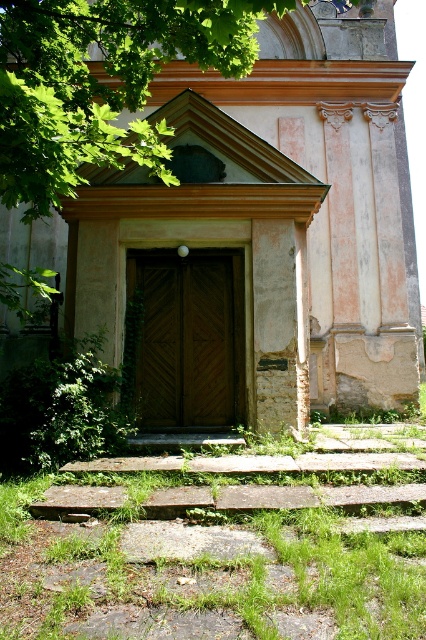
Who is more forward, (256, 179) or (109, 26)?

Point (109, 26)

Does wooden door at center have a lesser width compared to green leafy tree at upper left?

Correct, wooden door at center's width is less than green leafy tree at upper left's.

Locate an element on the screen. This screenshot has width=426, height=640. wooden door at center is located at coordinates (258, 234).

Where is `wooden door at center`? The height and width of the screenshot is (640, 426). wooden door at center is located at coordinates (258, 234).

Is wooden door at center further to the viewer compared to brown wooden door at center?

Yes.

From the picture: Is wooden door at center wider than brown wooden door at center?

In fact, wooden door at center might be narrower than brown wooden door at center.

Measure the distance between point (282, 278) and camera.

Point (282, 278) and camera are 7.33 meters apart from each other.

Image resolution: width=426 pixels, height=640 pixels. What are the coordinates of `wooden door at center` in the screenshot? It's located at (258, 234).

Is green leafy tree at upper left further to the viewer compared to brown wooden door at center?

No.

Can you confirm if green leafy tree at upper left is positioned to the left of brown wooden door at center?

Indeed, green leafy tree at upper left is positioned on the left side of brown wooden door at center.

At what (x,y) coordinates should I click in order to perform the action: click on green leafy tree at upper left. Please return your answer as a coordinate pair (x, y). Looking at the image, I should click on point(101,83).

Find the location of a particular element. green leafy tree at upper left is located at coordinates (101, 83).